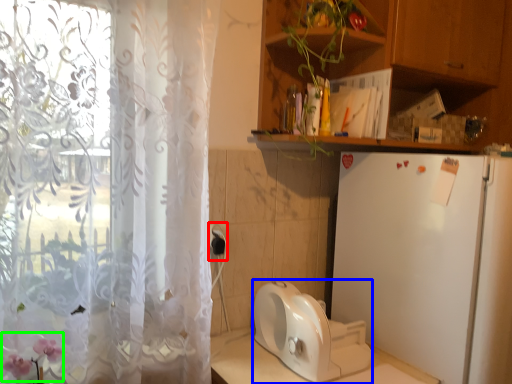
Question: Considering the real-world distances, which object is closest to electric outlet (highlighted by a red box)? appliance (highlighted by a blue box) or flower (highlighted by a green box).

Choices:
 (A) appliance
 (B) flower

Answer: (A)